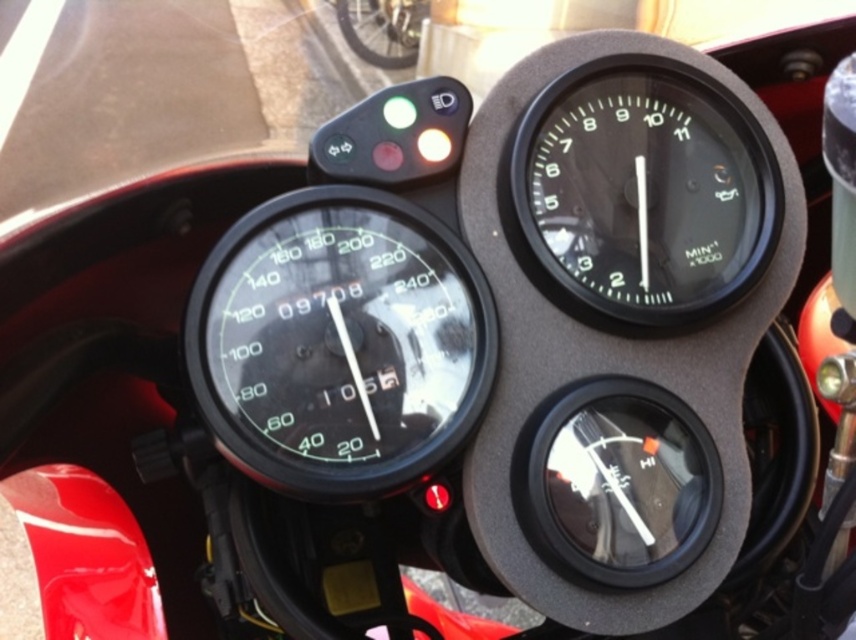
Question: Which object is farther from the camera taking this photo?

Choices:
 (A) black glass tachometer at upper right
 (B) black glass speedometer at center

Answer: (A)

Question: Does black glass speedometer at center have a greater width compared to black glass tachometer at upper right?

Choices:
 (A) yes
 (B) no

Answer: (A)

Question: From the image, what is the correct spatial relationship of black glass speedometer at center in relation to black glass tachometer at upper right?

Choices:
 (A) right
 (B) left

Answer: (B)

Question: Is black glass speedometer at center smaller than black glass tachometer at upper right?

Choices:
 (A) yes
 (B) no

Answer: (B)

Question: Among these points, which one is farthest from the camera?

Choices:
 (A) (275, 340)
 (B) (764, 227)

Answer: (B)